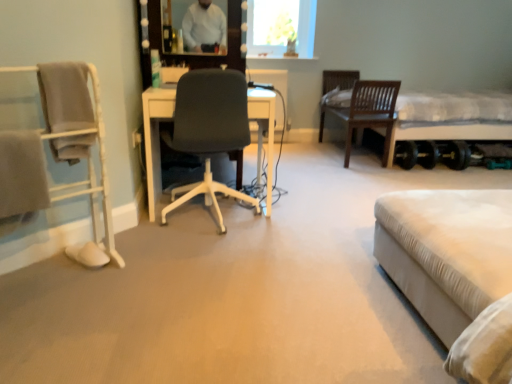
This screenshot has height=384, width=512. I want to click on free location in front of white fabric chair at left, acting as the 3th chair starting from the right, so click(48, 329).